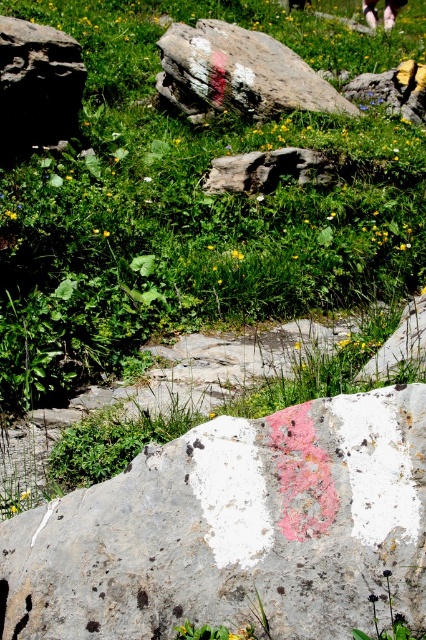
Consider the image. Does white stone at upper center have a larger size compared to pink fabric pants at upper center?

Yes.

Is white stone at upper center closer to camera compared to pink fabric pants at upper center?

Yes, white stone at upper center is in front of pink fabric pants at upper center.

Which is in front, point (391, 96) or point (388, 28)?

Point (391, 96) is in front.

You are a GUI agent. You are given a task and a screenshot of the screen. Output one action in this format:
    pyautogui.click(x=<x>, y=<y>)
    Task: Click on the white stone at upper center
    
    Given the screenshot: What is the action you would take?
    pyautogui.click(x=393, y=90)

Does smooth gray rock at upper left appear under pink fabric pants at upper center?

Yes.

Based on the photo, who is positioned more to the left, smooth gray rock at upper left or pink fabric pants at upper center?

smooth gray rock at upper left

Is point (25, 36) positioned before point (371, 10)?

Yes, point (25, 36) is closer to viewer.

The image size is (426, 640). I want to click on smooth gray rock at upper left, so click(37, 84).

Who is lower down, white painted rock at center or smooth gray rock at upper left?

Positioned lower is smooth gray rock at upper left.

Which is behind, point (328, 99) or point (31, 29)?

The point (328, 99) is behind.

The image size is (426, 640). Find the location of `white painted rock at center`. white painted rock at center is located at coordinates (238, 74).